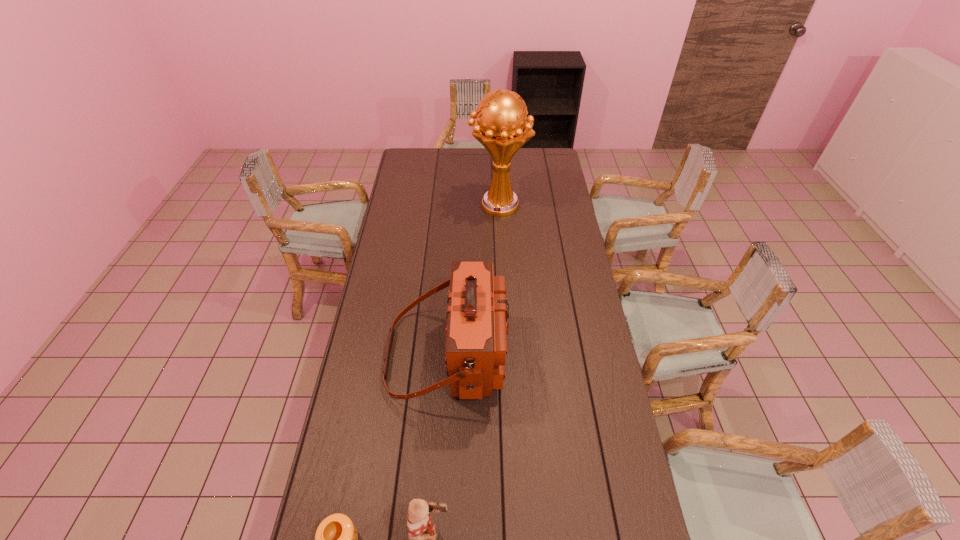
The image size is (960, 540). I want to click on vacant space at the left edge of the desktop, so click(x=371, y=384).

Locate an element on the screen. vacant region at the right edge is located at coordinates (547, 199).

This screenshot has width=960, height=540. In order to click on object that is the second closest to the trophy_cup in this screenshot , I will do `click(423, 533)`.

The height and width of the screenshot is (540, 960). In order to click on object that is the third closest one to the second shortest object in this screenshot , I will do `click(502, 127)`.